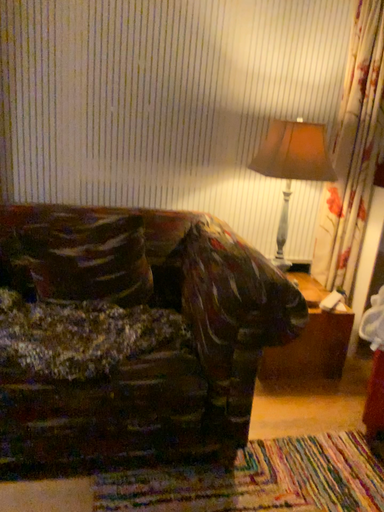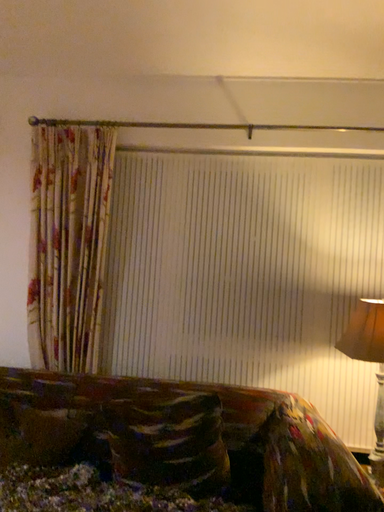
Question: How did the camera likely rotate when shooting the video?

Choices:
 (A) rotated upward
 (B) rotated downward

Answer: (A)